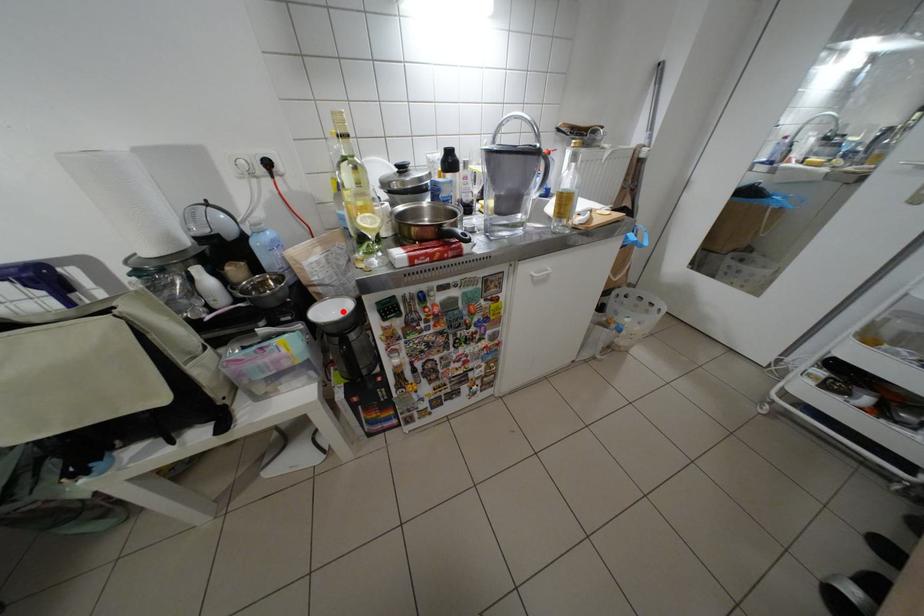
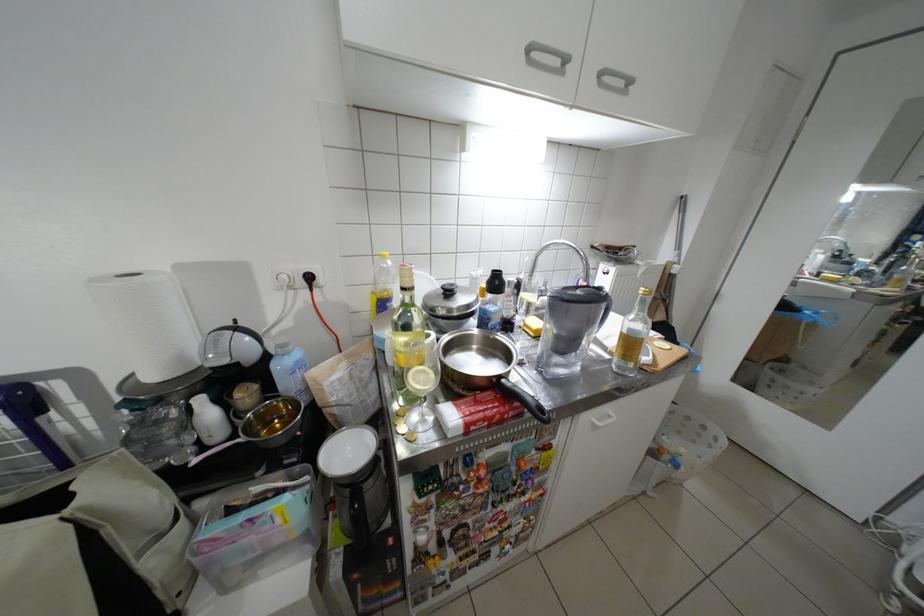
Where in the second image is the point corresponding to the highlighted location from the first image?

(359, 452)